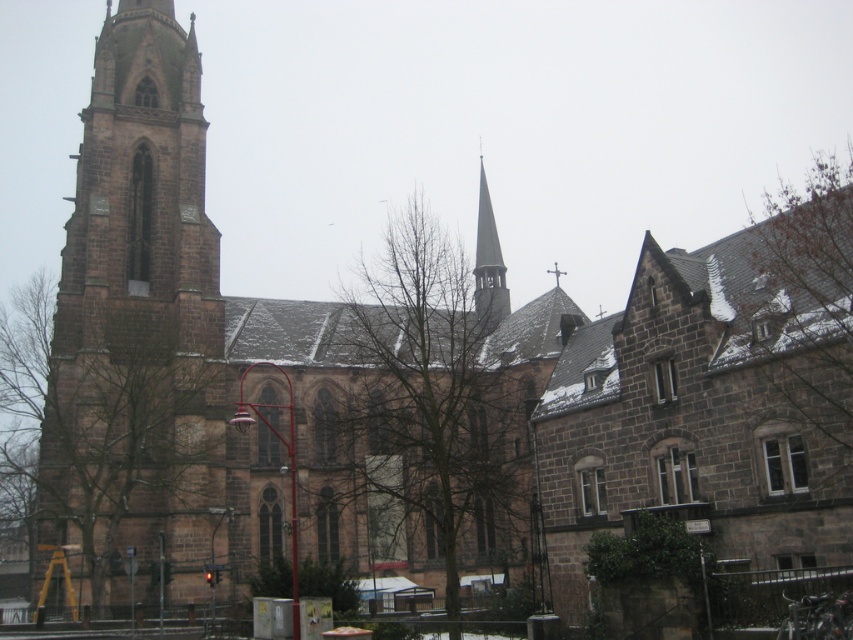
Question: Can you confirm if brown stone tower at left is thinner than smooth gray spire at center?

Choices:
 (A) yes
 (B) no

Answer: (B)

Question: Is brown stone tower at left above smooth gray spire at center?

Choices:
 (A) yes
 (B) no

Answer: (B)

Question: Which point appears farthest from the camera in this image?

Choices:
 (A) (125, 413)
 (B) (496, 259)

Answer: (B)

Question: Is brown stone tower at left positioned before smooth gray spire at center?

Choices:
 (A) yes
 (B) no

Answer: (A)

Question: Which of the following is the closest to the observer?

Choices:
 (A) smooth gray spire at center
 (B) brown stone tower at left

Answer: (B)